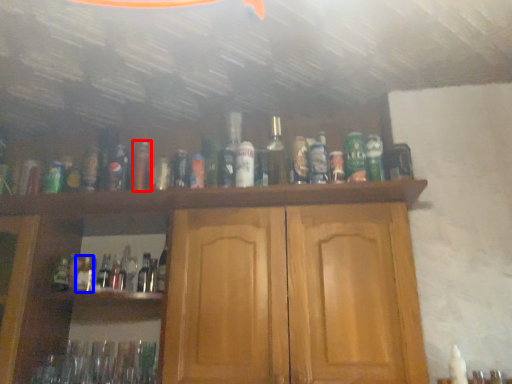
Question: Which point is closer to the camera, bottle (highlighted by a red box) or bottle (highlighted by a blue box)?

Choices:
 (A) bottle
 (B) bottle

Answer: (A)